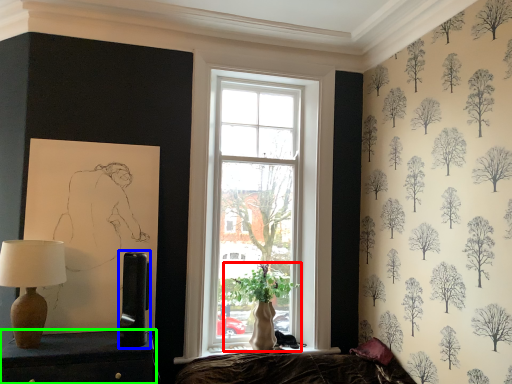
Question: Estimate the real-world distances between objects in this image. Which object is closer to houseplant (highlighted by a red box), table lamp (highlighted by a blue box) or furniture (highlighted by a green box)?

Choices:
 (A) table lamp
 (B) furniture

Answer: (A)